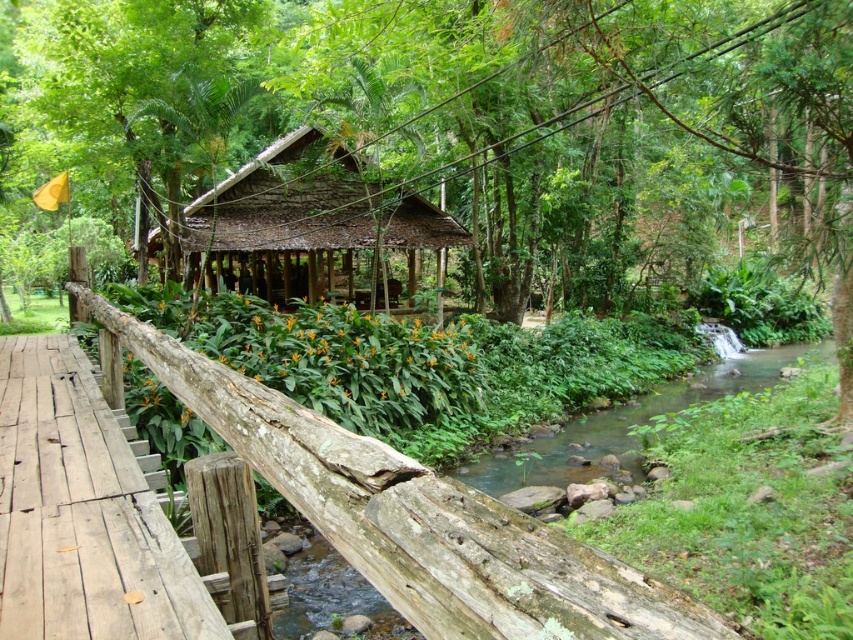
You are standing at the camera position and want to cross the wooden bridge at center to reach the other side. The bridge is 1.2 meters wide. Can you safely walk across it without falling off?

The wooden bridge at center is 1.2 meters wide, which is wider than an average person, so yes, you can safely walk across it without falling off.

You are a hiker who wants to cross the stream safely. The wooden bridge at center and the green mossy river at center are both in your path. Which one should you walk on to avoid getting wet?

You should walk on the wooden bridge at center because it is in front of the green mossy river at center, meaning it is positioned over the river and provides a dry crossing.

Looking at this image, you are a hiker who wants to cross the wooden bridge at center to reach the other side. However, you notice the green leafy forest at center is wider than the bridge. Does this mean the forest is also longer than the bridge?

The green leafy forest at center is wider than the wooden bridge at center, but the question of length isn